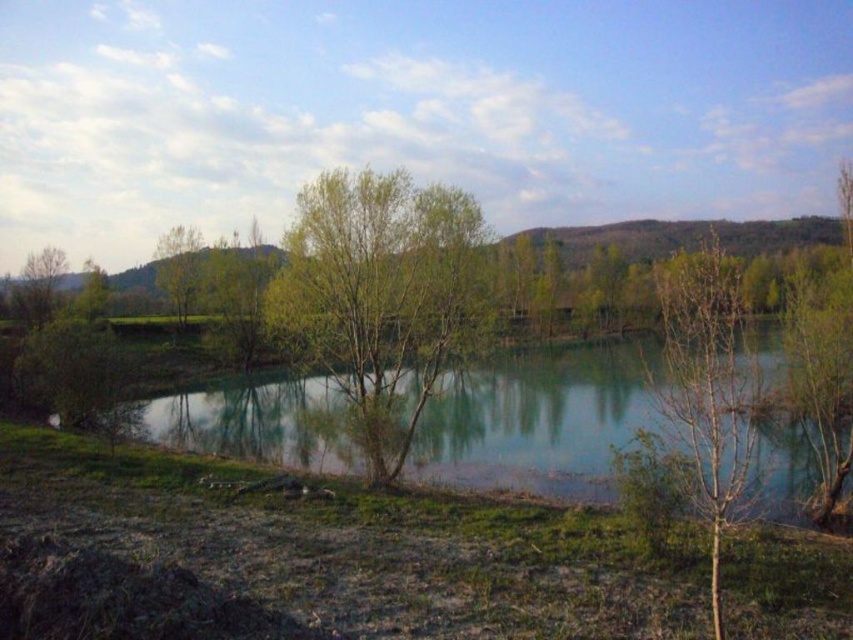
Is green matte tree at center-left thinner than green matte tree at left?

No, green matte tree at center-left is not thinner than green matte tree at left.

Which is in front, point (167, 273) or point (57, 259)?

Point (57, 259)

What are the coordinates of `green matte tree at center-left` in the screenshot? It's located at [178, 266].

Can you confirm if green reflective water at center is smaller than green matte tree at center-left?

Indeed, green reflective water at center has a smaller size compared to green matte tree at center-left.

Consider the image. Which is more to the right, green reflective water at center or green matte tree at center-left?

From the viewer's perspective, green reflective water at center appears more on the right side.

This screenshot has width=853, height=640. Identify the location of green reflective water at center. (543, 419).

At what (x,y) coordinates should I click in order to perform the action: click on green reflective water at center. Please return your answer as a coordinate pair (x, y). The height and width of the screenshot is (640, 853). Looking at the image, I should click on (543, 419).

Image resolution: width=853 pixels, height=640 pixels. What do you see at coordinates (380, 296) in the screenshot? I see `green leafy tree at center` at bounding box center [380, 296].

Who is more distant from viewer, [402,205] or [718,268]?

Positioned behind is point [402,205].

The width and height of the screenshot is (853, 640). I want to click on green leafy tree at center, so click(380, 296).